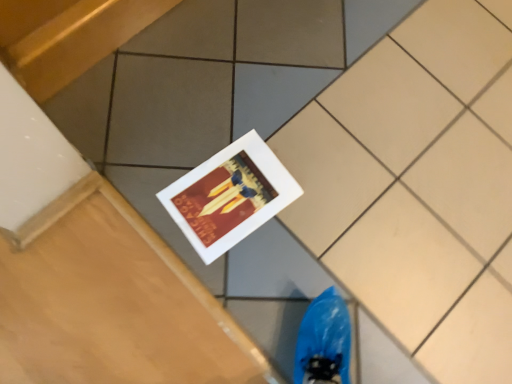
Locate an element on the screen. vacant space situated on the left part of white matte picture frame at center is located at coordinates (159, 150).